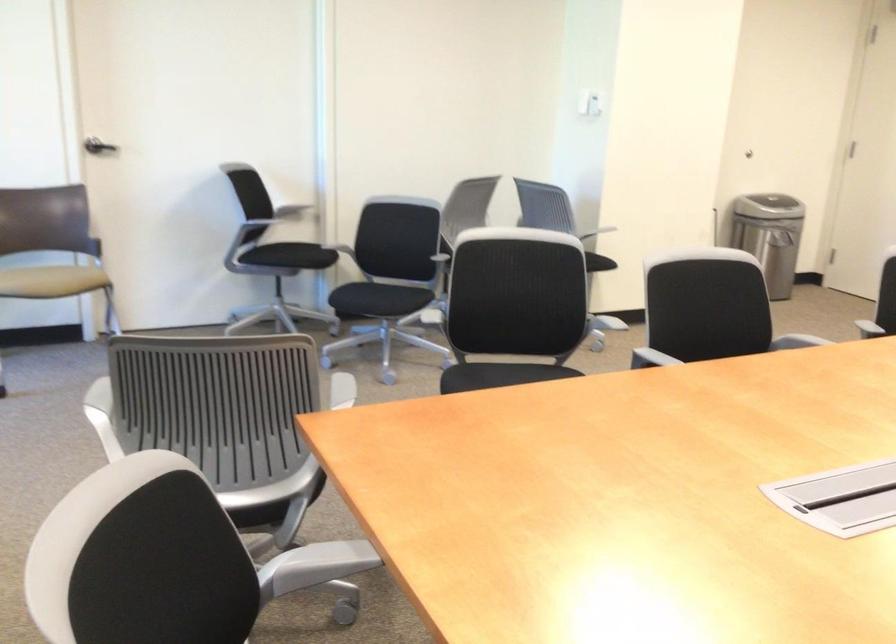
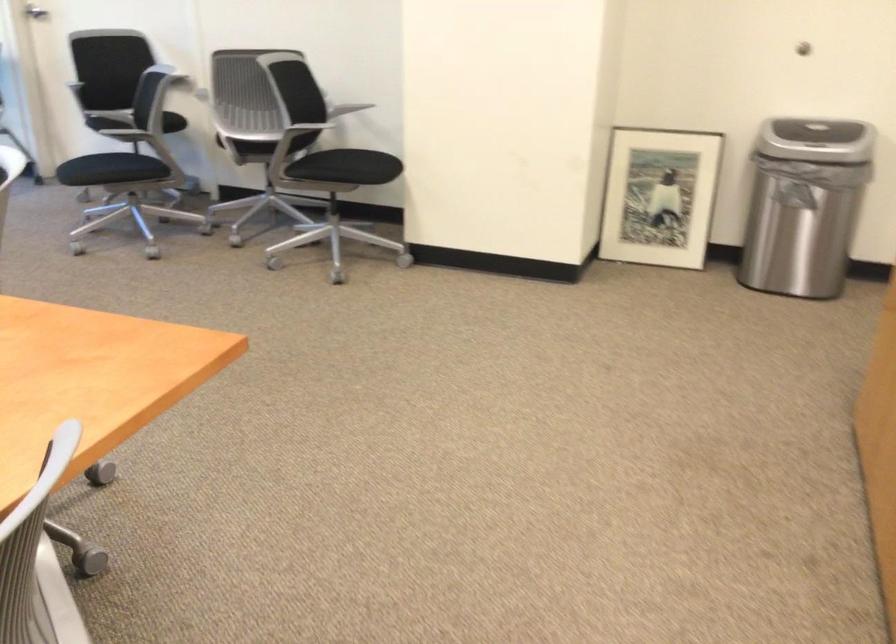
Where in the second image is the point corresponding to (x=91, y=181) from the first image?

(36, 12)